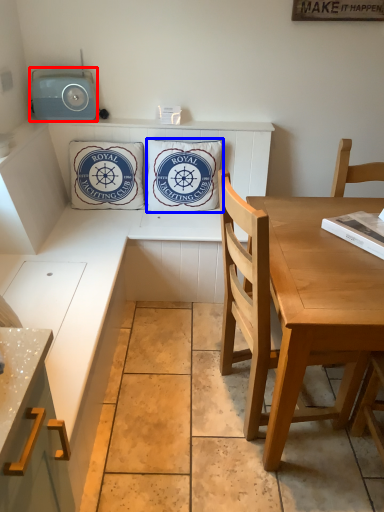
Question: Which object is closer to the camera taking this photo, radio (highlighted by a red box) or pillow (highlighted by a blue box)?

Choices:
 (A) radio
 (B) pillow

Answer: (A)